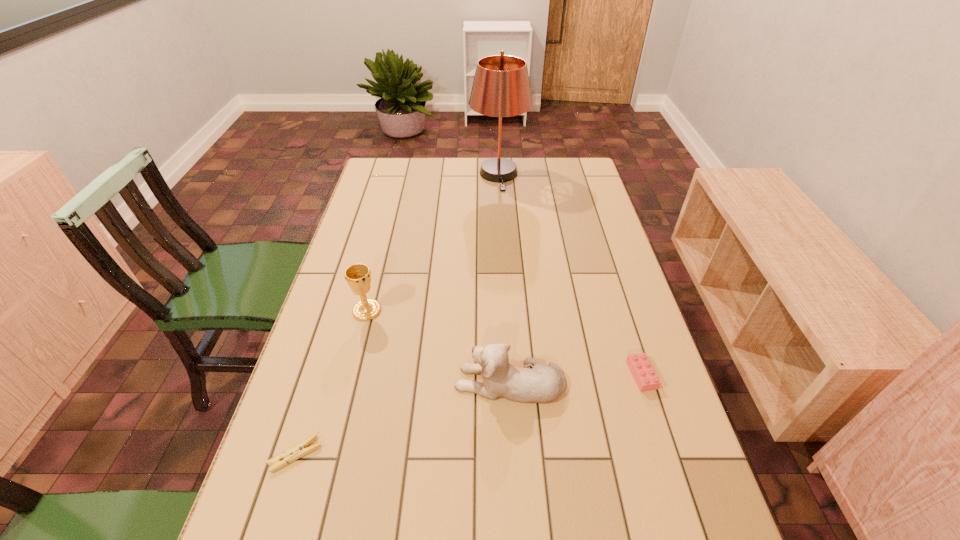
Find the location of a particular element. lampshade is located at coordinates (501, 88).

I want to click on the tallest object, so click(501, 88).

The height and width of the screenshot is (540, 960). What are the coordinates of `chalice` in the screenshot? It's located at (358, 276).

At what (x,y) coordinates should I click in order to perform the action: click on puppy. Please return your answer as a coordinate pair (x, y). The image size is (960, 540). Looking at the image, I should click on (543, 383).

Find the location of a particular element. Lego is located at coordinates (644, 374).

In order to click on the rightmost object in this screenshot , I will do `click(644, 374)`.

The image size is (960, 540). I want to click on the shortest object, so click(298, 451).

This screenshot has height=540, width=960. In order to click on clothespin in this screenshot , I will do `click(298, 451)`.

This screenshot has height=540, width=960. I want to click on free space located 0.200m on the front-facing side of the tallest object, so click(502, 223).

Locate an element on the screen. Image resolution: width=960 pixels, height=540 pixels. free region located on the back of the fourth nearest object is located at coordinates (374, 281).